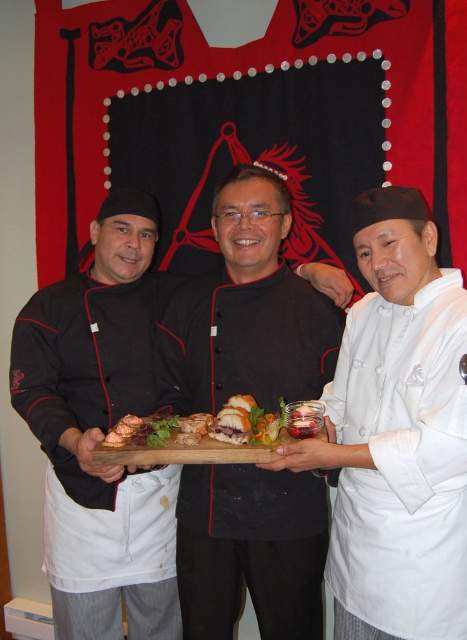
Question: Does white matte chef coat at center have a larger size compared to golden brown bread at center?

Choices:
 (A) no
 (B) yes

Answer: (B)

Question: Which object appears closest to the camera in this image?

Choices:
 (A) golden brown bread at center
 (B) black matte chef's coat at left

Answer: (A)

Question: Which of the following is the farthest from the observer?

Choices:
 (A) (400, 580)
 (B) (318, 413)
 (C) (131, 339)

Answer: (C)

Question: Does black matte chef's coat at left appear on the left side of golden brown bread at center?

Choices:
 (A) no
 (B) yes

Answer: (B)

Question: Can you confirm if black matte chef's coat at left is wider than golden brown bread at center?

Choices:
 (A) yes
 (B) no

Answer: (B)

Question: Which of the following is the closest to the observer?

Choices:
 (A) black matte chef's coat at left
 (B) white matte chef coat at center
 (C) golden brown bread at center

Answer: (B)